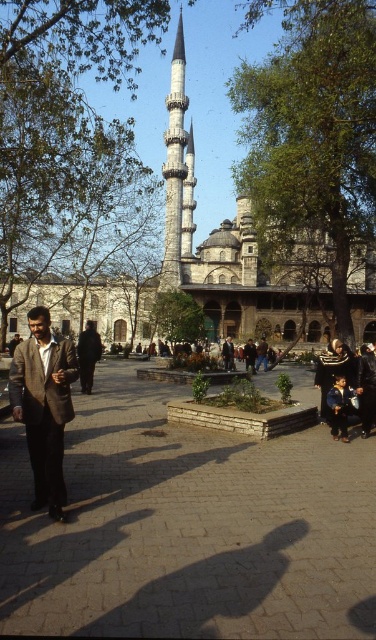
You are standing at the entrance of the Blue Mosque and want to reach the brick pavement at center. Which direction should you walk to reach it?

You should walk forward from the entrance to reach the brick pavement at center since it is located at point (188, 528), which is ahead in the central area.

You are a tourist standing in the courtyard of the Blue Mosque. You see the brick pavement at center and the dark blue jeans at lower right. Which object is nearer to you?

The brick pavement at center is closer to the viewer than the dark blue jeans at lower right.